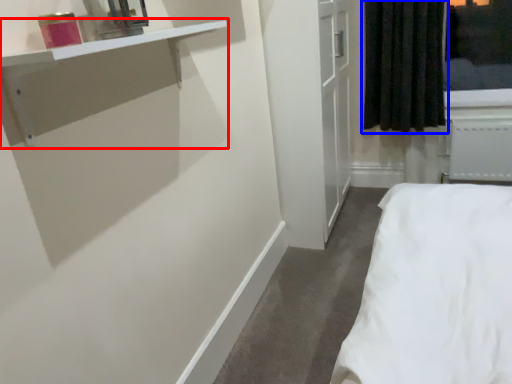
Question: Which of the following is the closest to the observer, vanity (highlighted by a red box) or curtain (highlighted by a blue box)?

Choices:
 (A) vanity
 (B) curtain

Answer: (A)